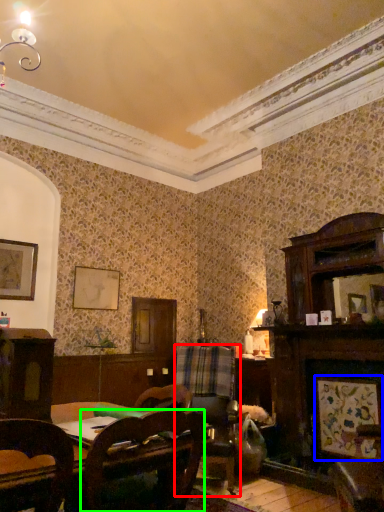
Question: Which is nearer to the swivel chair (highlighted by a red box)? picture frame (highlighted by a blue box) or chair (highlighted by a green box).

Choices:
 (A) picture frame
 (B) chair

Answer: (A)